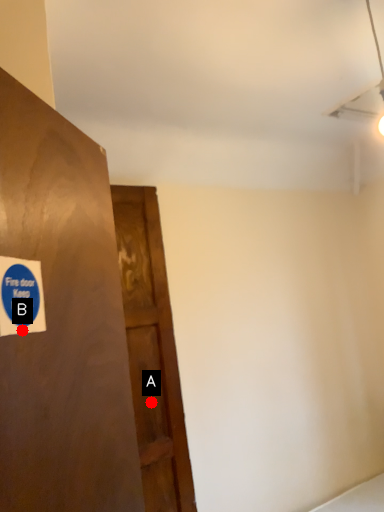
Question: Two points are circled on the image, labeled by A and B beside each circle. Among these points, which one is farthest from the camera?

Choices:
 (A) A is further
 (B) B is further

Answer: (A)